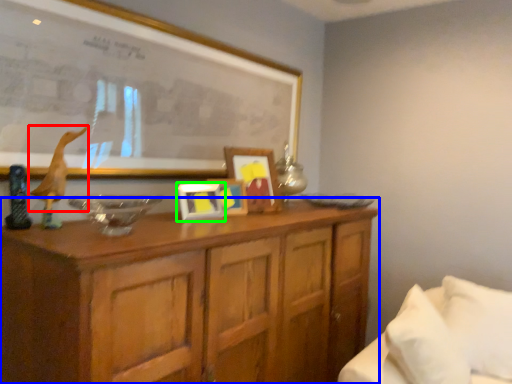
Question: Which object is the farthest from animal (highlighted by a red box)? Choose among these: cabinetry (highlighted by a blue box) or picture frame (highlighted by a green box).

Choices:
 (A) cabinetry
 (B) picture frame

Answer: (A)